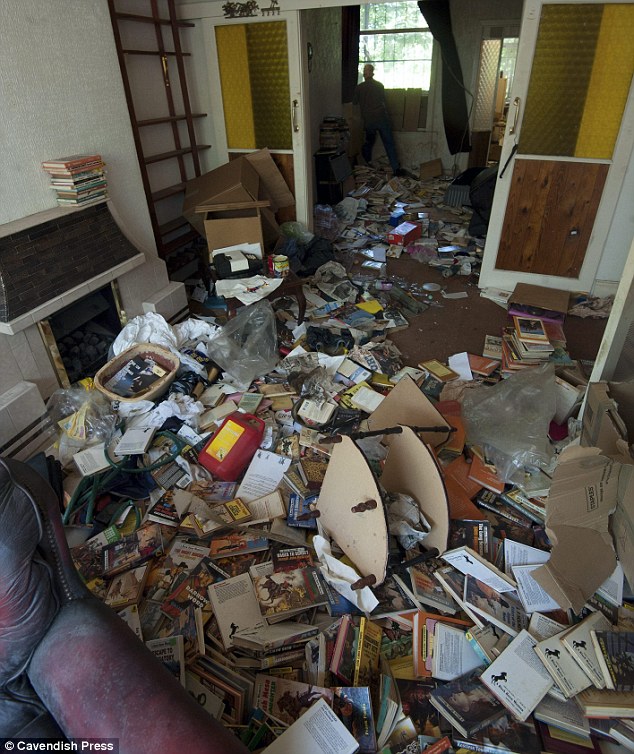
You are a GUI agent. You are given a task and a screenshot of the screen. Output one action in this format:
    pyautogui.click(x=<x>, y=<y>)
    Task: Click on the curtains
    The height and width of the screenshot is (754, 634).
    Given the screenshot: What is the action you would take?
    pyautogui.click(x=353, y=47)